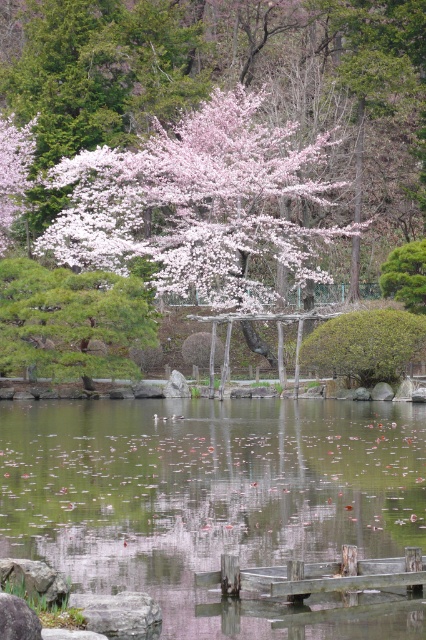
What do you see at coordinates (199, 204) in the screenshot? I see `pink blossoms at center` at bounding box center [199, 204].

Between pink blossoms at center and green textured rock at left, which one is positioned higher?

Positioned higher is pink blossoms at center.

Identify the location of pink blossoms at center. Image resolution: width=426 pixels, height=640 pixels. (199, 204).

You are a GUI agent. You are given a task and a screenshot of the screen. Output one action in this format:
    pyautogui.click(x=<x>, y=<y>)
    Task: Click on the pink blossoms at center
    
    Given the screenshot: What is the action you would take?
    pyautogui.click(x=199, y=204)

Find the location of a particular element. Image resolution: width=426 pixels, height=640 pixels. transparent water at center is located at coordinates (215, 500).

You are a GUI agent. You are given a task and a screenshot of the screen. Output one action in this format:
    pyautogui.click(x=<x>, y=<y>)
    Task: Click on the transparent water at center
    
    Given the screenshot: What is the action you would take?
    pyautogui.click(x=215, y=500)

Who is positioned more to the left, pink matte tree at center or transparent water at center?

From the viewer's perspective, pink matte tree at center appears more on the left side.

Does pink matte tree at center appear under transparent water at center?

No.

Between point (106, 64) and point (244, 561), which one is positioned behind?

Point (106, 64)

Where is `pink matte tree at center`? pink matte tree at center is located at coordinates (230, 99).